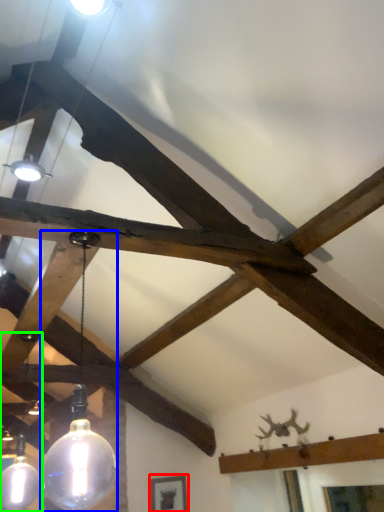
Question: Which object is positioned closest to picture frame (highlighted by a red box)? Select from lamp (highlighted by a blue box) and lamp (highlighted by a green box).

Choices:
 (A) lamp
 (B) lamp

Answer: (B)